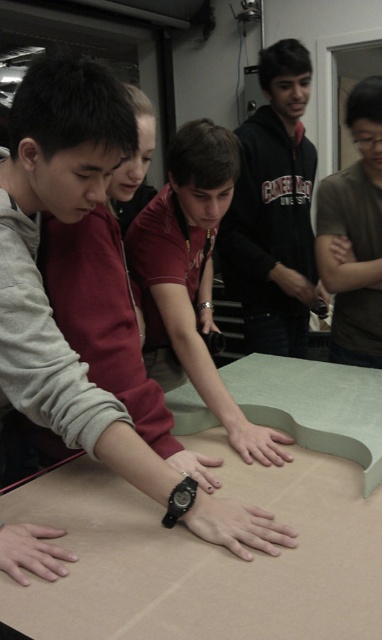
Who is taller, matte red shirt at center or black rubber watch at center?

matte red shirt at center is taller.

Is matte red shirt at center taller than black rubber watch at center?

Indeed, matte red shirt at center has a greater height compared to black rubber watch at center.

Is point (210, 314) behind point (192, 467)?

Yes.

The height and width of the screenshot is (640, 382). In order to click on matte red shirt at center in this screenshot , I will do `click(192, 273)`.

Who is lower down, brown cardboard table at center or skinny white hand at center?

skinny white hand at center is below.

Between point (364, 456) and point (250, 512), which one is positioned in front?

Point (250, 512) is in front.

Identify the location of brown cardboard table at center. The width and height of the screenshot is (382, 640). (218, 548).

What do you see at coordinates (354, 234) in the screenshot?
I see `brown matte shirt at upper right` at bounding box center [354, 234].

Identify the location of brown matte shirt at upper right. This screenshot has height=640, width=382. (354, 234).

Image resolution: width=382 pixels, height=640 pixels. I want to click on brown matte shirt at upper right, so click(354, 234).